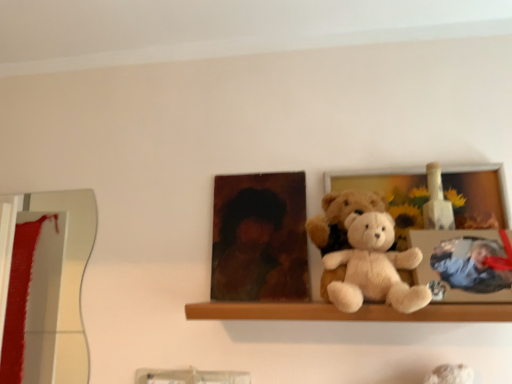
Question: Is wooden photo frame at center positioned far away from wooden shelf at center?

Choices:
 (A) yes
 (B) no

Answer: (B)

Question: From the image's perspective, is wooden photo frame at center under wooden shelf at center?

Choices:
 (A) no
 (B) yes

Answer: (A)

Question: Does wooden photo frame at center contain wooden shelf at center?

Choices:
 (A) no
 (B) yes

Answer: (A)

Question: Does wooden photo frame at center lie behind wooden shelf at center?

Choices:
 (A) no
 (B) yes

Answer: (B)

Question: Does wooden photo frame at center have a larger size compared to wooden shelf at center?

Choices:
 (A) yes
 (B) no

Answer: (B)

Question: Can you confirm if wooden photo frame at center is wider than wooden shelf at center?

Choices:
 (A) yes
 (B) no

Answer: (B)

Question: Can you confirm if matte brown portrait at center is smaller than fluffy beige teddy bear at center, marked as the 2th teddy bear in a front-to-back arrangement?

Choices:
 (A) no
 (B) yes

Answer: (B)

Question: Could you tell me if matte brown portrait at center is turned towards fluffy beige teddy bear at center, arranged as the first teddy bear when viewed from the back?

Choices:
 (A) no
 (B) yes

Answer: (A)

Question: Can you confirm if matte brown portrait at center is positioned to the left of fluffy beige teddy bear at center, arranged as the first teddy bear when viewed from the back?

Choices:
 (A) no
 (B) yes

Answer: (B)

Question: From the image's perspective, is matte brown portrait at center under fluffy beige teddy bear at center, marked as the 2th teddy bear in a front-to-back arrangement?

Choices:
 (A) yes
 (B) no

Answer: (B)

Question: Is matte brown portrait at center completely or partially outside of fluffy beige teddy bear at center, arranged as the first teddy bear when viewed from the back?

Choices:
 (A) no
 (B) yes

Answer: (B)

Question: Is matte brown portrait at center looking in the opposite direction of fluffy beige teddy bear at center, marked as the 2th teddy bear in a front-to-back arrangement?

Choices:
 (A) no
 (B) yes

Answer: (A)

Question: Could you tell me if wooden shelf at center is turned towards white plush teddy bear at center, which ranks as the 1th teddy bear in front-to-back order?

Choices:
 (A) no
 (B) yes

Answer: (A)